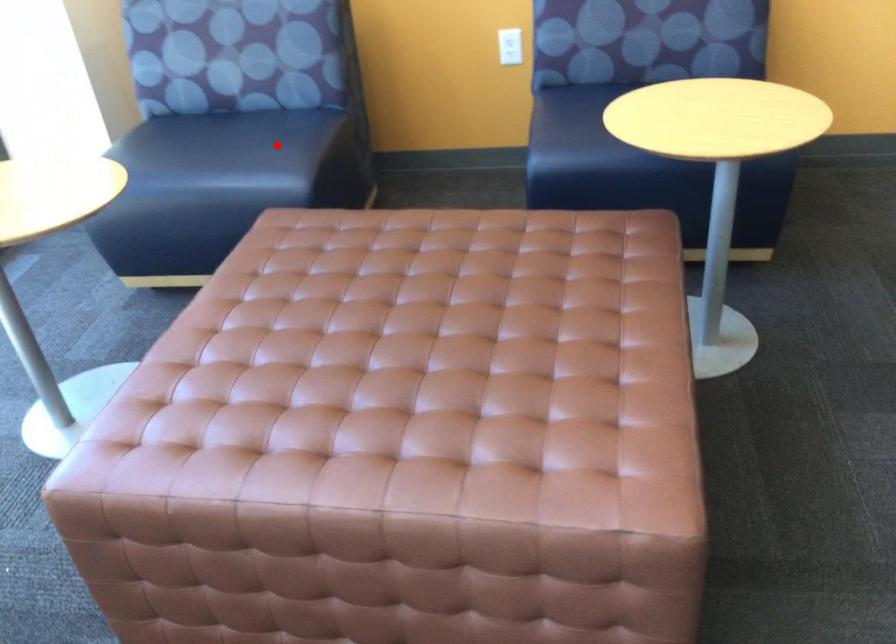
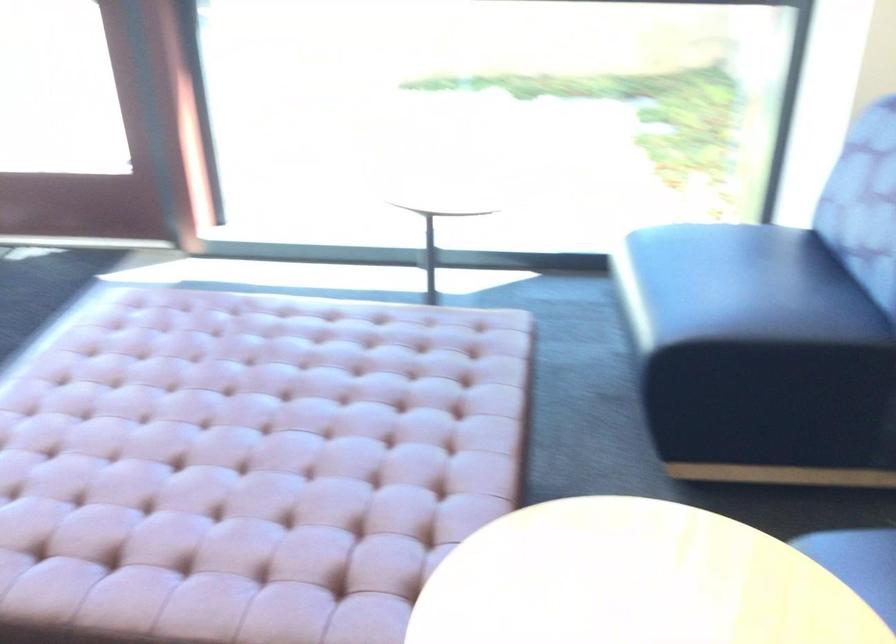
Question: I am providing you with two images of the same scene from different viewpoints. In image1, a red point is highlighted. Considering the same 3D point in image2, which of the following is correct?

Choices:
 (A) It is closer
 (B) It is farther

Answer: (A)